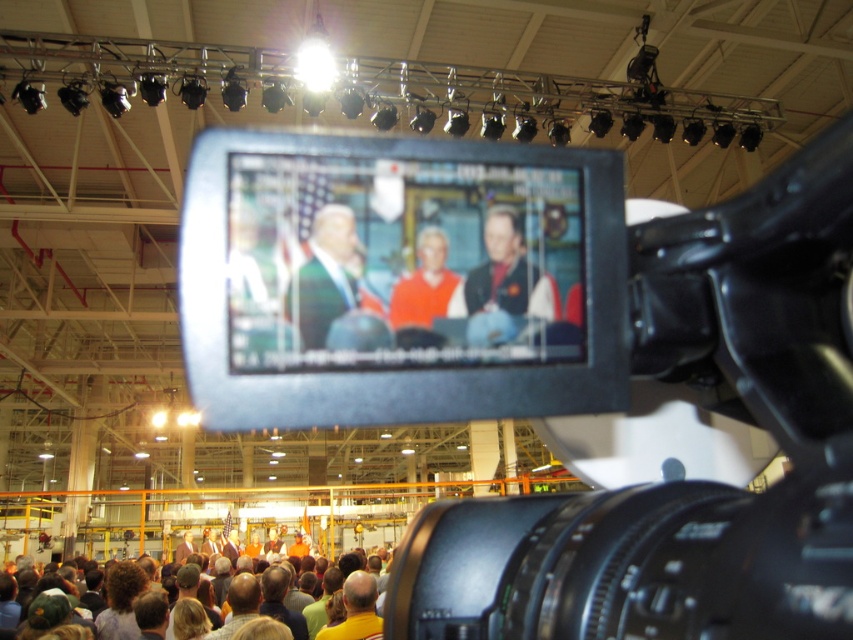
Can you confirm if matte plastic monitor at center is bigger than green fabric suit at center?

Yes.

Which is below, matte plastic monitor at center or green fabric suit at center?

Positioned lower is green fabric suit at center.

Locate an element on the screen. The height and width of the screenshot is (640, 853). matte plastic monitor at center is located at coordinates (401, 262).

I want to click on matte plastic monitor at center, so click(x=401, y=262).

Does black plastic video camera at center have a greater height compared to smooth blue shirt at center?

Indeed, black plastic video camera at center has a greater height compared to smooth blue shirt at center.

Who is positioned more to the left, black plastic video camera at center or smooth blue shirt at center?

black plastic video camera at center is more to the left.

This screenshot has width=853, height=640. Find the location of `black plastic video camera at center`. black plastic video camera at center is located at coordinates (553, 371).

Is smooth blue shirt at center further to the viewer compared to orange fabric sweater at center?

Yes, smooth blue shirt at center is further from the viewer.

Can you confirm if smooth blue shirt at center is positioned below orange fabric sweater at center?

No, smooth blue shirt at center is not below orange fabric sweater at center.

Is point (476, 273) more distant than point (393, 300)?

Yes, point (476, 273) is behind point (393, 300).

Find the location of a particular element. This screenshot has width=853, height=640. smooth blue shirt at center is located at coordinates (508, 273).